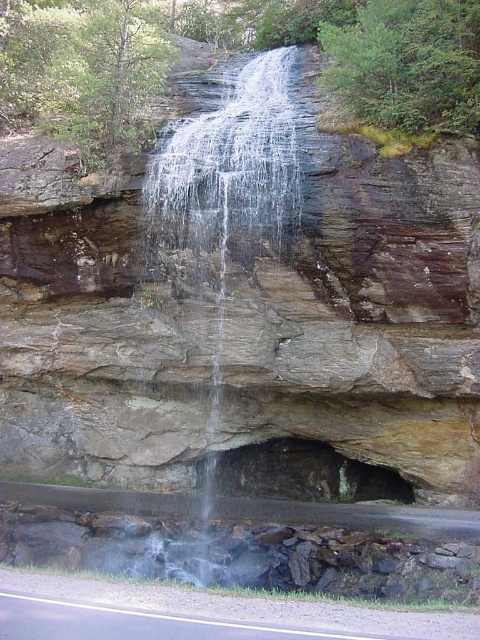
Question: Is brown rough rock face at center thinner than clear water at center?

Choices:
 (A) no
 (B) yes

Answer: (A)

Question: Which object appears closest to the camera in this image?

Choices:
 (A) brown rough rock face at center
 (B) clear water at center

Answer: (B)

Question: Among these objects, which one is nearest to the camera?

Choices:
 (A) brown rough rock face at center
 (B) clear water at center

Answer: (B)

Question: Does brown rough rock face at center appear on the right side of clear water at center?

Choices:
 (A) yes
 (B) no

Answer: (A)

Question: Among these points, which one is nearest to the camera?

Choices:
 (A) (186, 140)
 (B) (297, 157)

Answer: (B)

Question: Does brown rough rock face at center appear on the right side of clear water at center?

Choices:
 (A) yes
 (B) no

Answer: (A)